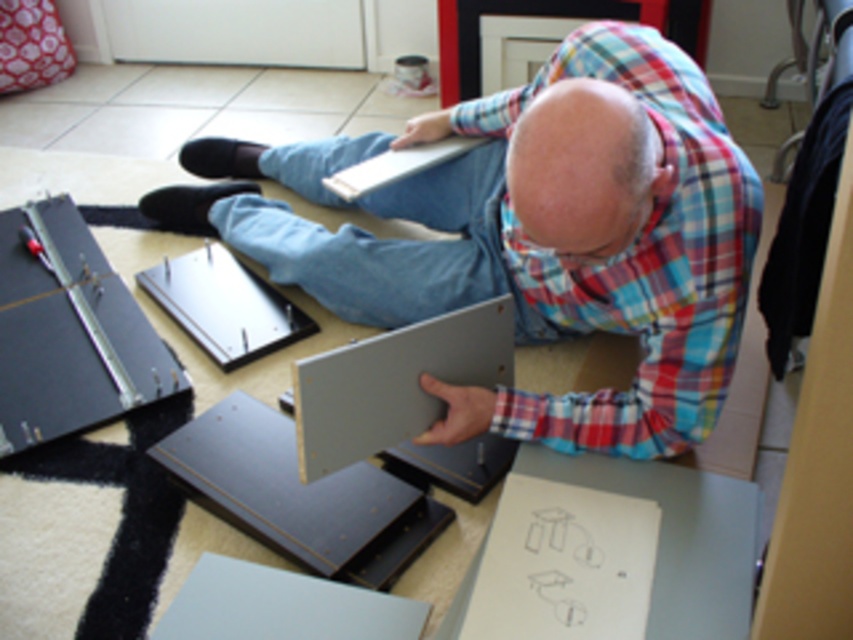
You are helping someone assemble furniture and need to place a matte gray panel at center and a metallic silver bracket at lower left. The instructions say the panel must be wider than the bracket. Does the current arrangement meet the requirement?

Yes, the current arrangement meets the requirement because the matte gray panel at center is wider than the metallic silver bracket at lower left according to the description.

From the picture: You are a delivery person who just arrived at the address. You need to place a package on the floor near the matte gray panel at center. Based on the coordinates provided, where should you place the package?

The package should be placed near the coordinates point at (535, 234) where the matte gray panel at center is located.

You are a delivery robot that needs to place a matte gray panel at center on a shelf that is 4 feet away. Can you reach the shelf from your current position?

The matte gray panel at center and camera are 3.69 feet apart, so the shelf is 4 feet away from the camera. Since the distance between the robot and the shelf is 4 feet minus 3.69 feet, which is 0.31 feet, the robot can reach the shelf to place the matte gray panel at center.